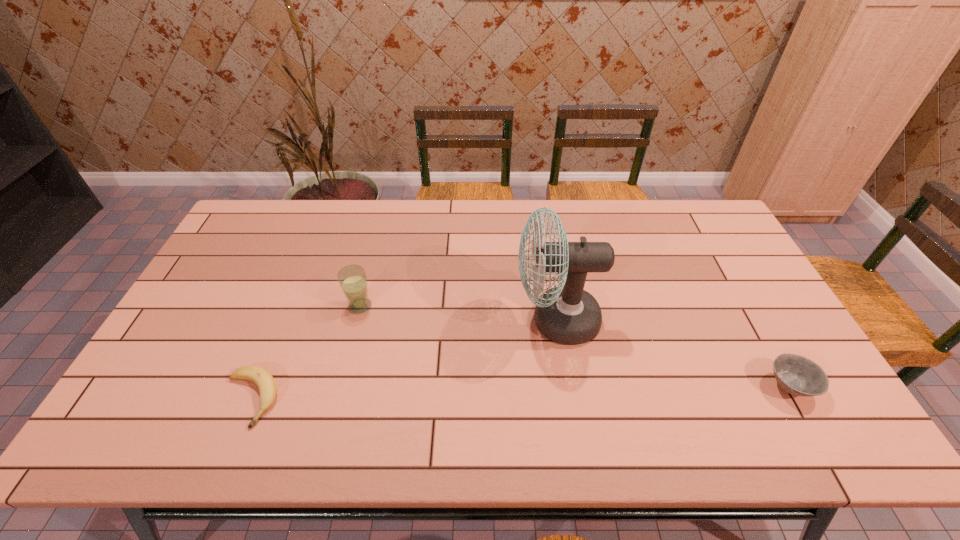
I want to click on the tallest object, so click(x=567, y=314).

Identify the location of the second object from right to left. This screenshot has height=540, width=960. (567, 314).

Identify the location of the second object from left to right. (352, 279).

You are a GUI agent. You are given a task and a screenshot of the screen. Output one action in this format:
    pyautogui.click(x=<x>, y=<y>)
    Task: Click on the second tallest object
    This screenshot has width=960, height=540.
    Given the screenshot: What is the action you would take?
    pyautogui.click(x=352, y=279)

Locate an element on the screen. The image size is (960, 540). the second shortest object is located at coordinates (797, 375).

Find the location of `the rightmost object`. the rightmost object is located at coordinates (797, 375).

Image resolution: width=960 pixels, height=540 pixels. What are the coordinates of `the leftmost object` in the screenshot? It's located at (262, 378).

Locate an element on the screen. This screenshot has width=960, height=540. the shortest object is located at coordinates (262, 378).

You are a GUI agent. You are given a task and a screenshot of the screen. Output one action in this format:
    pyautogui.click(x=<x>, y=<y>)
    Task: Click on the vacant region located in front of the third object from left to right where the airflow is directed
    The height and width of the screenshot is (540, 960).
    Given the screenshot: What is the action you would take?
    pyautogui.click(x=433, y=320)

Image resolution: width=960 pixels, height=540 pixels. In order to click on vacant space located 0.230m in front of the third object from left to right where the airflow is directed in this screenshot , I will do `click(433, 320)`.